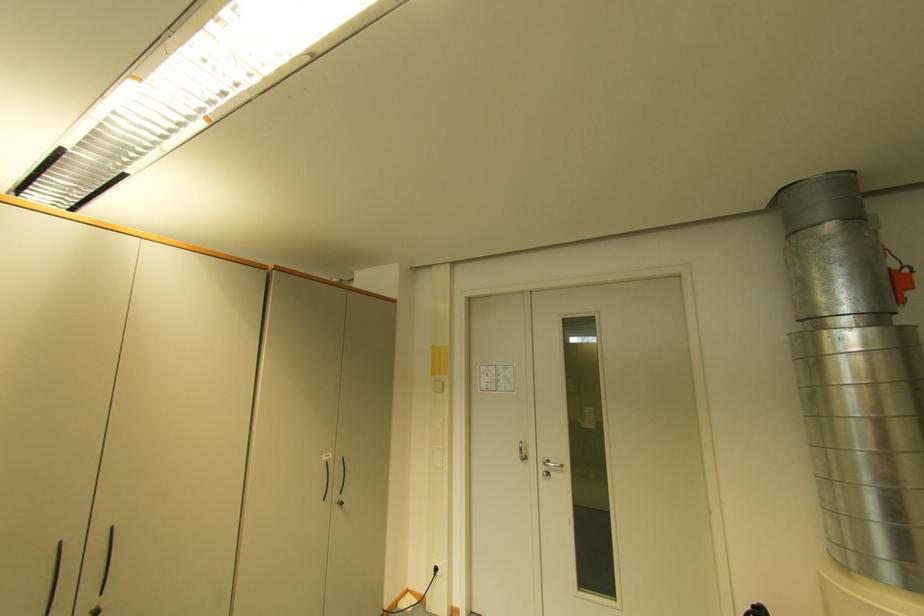
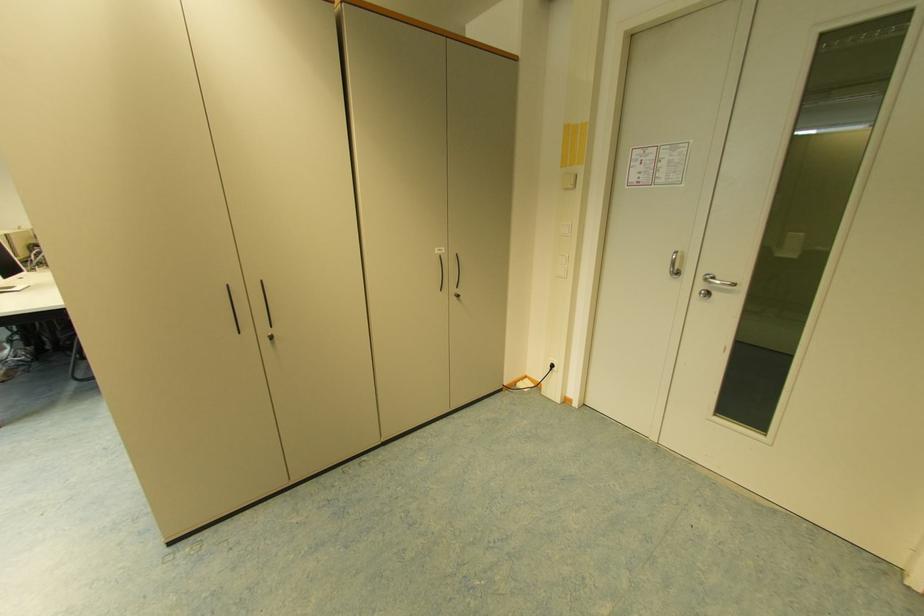
The point at (548, 464) is marked in the first image. Where is the corresponding point in the second image?

(710, 280)